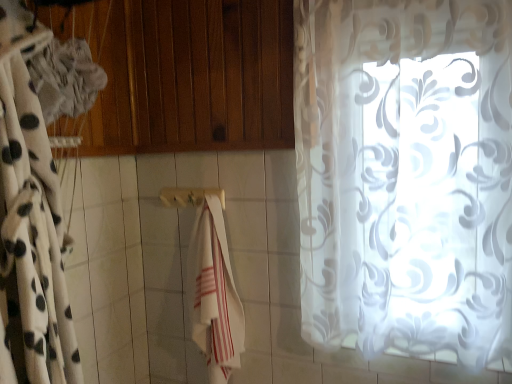
Question: From their relative heights in the image, would you say white sheer curtain at left, the second curtain viewed from the right, is taller or shorter than wooden towel bar at center?

Choices:
 (A) short
 (B) tall

Answer: (B)

Question: From the image's perspective, is white sheer curtain at left, the second curtain viewed from the right, above or below wooden towel bar at center?

Choices:
 (A) below
 (B) above

Answer: (A)

Question: Which object is the farthest from the white sheer curtain at left, the second curtain viewed from the right?

Choices:
 (A) transparent floral-patterned curtain at right, arranged as the first curtain when viewed from the right
 (B) wooden towel bar at center
 (C) white cotton towel at center

Answer: (A)

Question: Which object is positioned closest to the transparent floral-patterned curtain at right, arranged as the first curtain when viewed from the right?

Choices:
 (A) white sheer curtain at left, placed as the 1th curtain when sorted from left to right
 (B) wooden towel bar at center
 (C) white cotton towel at center

Answer: (C)